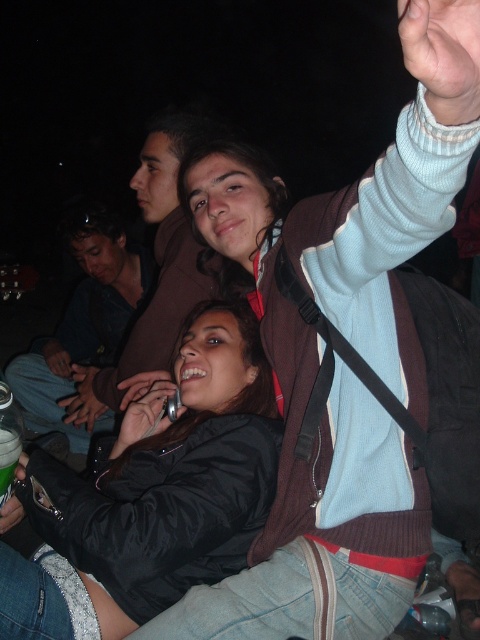
You are at a social event and want to approach the person wearing the black satin jacket at lower left. Which direction should you move relative to the matte brown jacket at upper center?

The black satin jacket at lower left is in front of the matte brown jacket at upper center, so you should move forward towards the black satin jacket at lower left.

You are standing in the scene and want to move from the point at coordinates point (266, 365) to the point at coordinates point (8, 493). Which direction should you move in to get closer to your destination?

Since point (266, 365) is further to the viewer than point (8, 493), you should move forward to get closer to your destination.